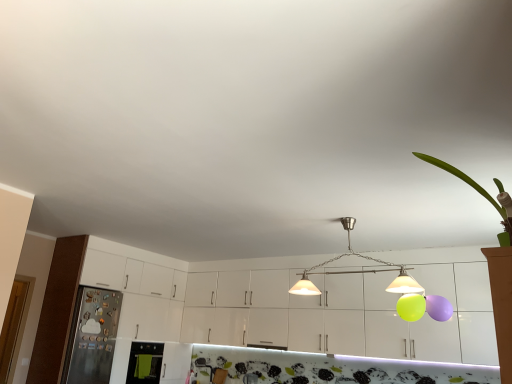
Measure the distance between green fabric oven at lower left, the 2th appliance from the left, and camera.

green fabric oven at lower left, the 2th appliance from the left, and camera are 17.53 feet apart from each other.

This screenshot has height=384, width=512. What do you see at coordinates (145, 363) in the screenshot?
I see `green fabric oven at lower left, the 2th appliance from the left` at bounding box center [145, 363].

What do you see at coordinates (249, 304) in the screenshot? The image size is (512, 384). I see `white glossy cabinets at center` at bounding box center [249, 304].

This screenshot has height=384, width=512. Identify the location of metallic refrigerator at left, the 2th appliance viewed from the right. tap(92, 336).

At what (x,y) coordinates should I click in order to perform the action: click on metallic pendant lights at center. Please return your answer as a coordinate pair (x, y). The width and height of the screenshot is (512, 384). Looking at the image, I should click on (364, 258).

Does metallic refrigerator at left, the 2th appliance viewed from the right, have a greater width compared to green fabric oven at lower left, the 2th appliance from the left?

Yes, metallic refrigerator at left, the 2th appliance viewed from the right, is wider than green fabric oven at lower left, the 2th appliance from the left.

Is metallic refrigerator at left, the 2th appliance viewed from the right, next to green fabric oven at lower left, the 2th appliance from the left, and touching it?

No, metallic refrigerator at left, the 2th appliance viewed from the right, is not beside green fabric oven at lower left, the 2th appliance from the left.

Does metallic refrigerator at left, acting as the first appliance starting from the left, have a larger size compared to green fabric oven at lower left, the 1th appliance positioned from the right?

Yes.

In the scene shown: Is metallic refrigerator at left, the 2th appliance viewed from the right, positioned with its back to green fabric oven at lower left, the 2th appliance from the left?

No, metallic refrigerator at left, the 2th appliance viewed from the right, is not facing away from green fabric oven at lower left, the 2th appliance from the left.

Which object is thinner, metallic refrigerator at left, the 2th appliance viewed from the right, or green leafy plant at upper right?

green leafy plant at upper right.

From the image's perspective, is metallic refrigerator at left, acting as the first appliance starting from the left, located above or below green leafy plant at upper right?

metallic refrigerator at left, acting as the first appliance starting from the left, is below green leafy plant at upper right.

From the image's perspective, which is above, metallic refrigerator at left, acting as the first appliance starting from the left, or white glossy cabinets at center?

white glossy cabinets at center, from the image's perspective.

From a real-world perspective, which object stands above the other?

From a 3D spatial view, white glossy cabinets at center is above.

What's the angular difference between metallic refrigerator at left, the 2th appliance viewed from the right, and white glossy cabinets at center's facing directions?

The angular difference between metallic refrigerator at left, the 2th appliance viewed from the right, and white glossy cabinets at center is 90 degrees.

Is metallic refrigerator at left, the 2th appliance viewed from the right, wider or thinner than white glossy cabinets at center?

Clearly, metallic refrigerator at left, the 2th appliance viewed from the right, has more width compared to white glossy cabinets at center.

In terms of height, does metallic pendant lights at center look taller or shorter compared to green leafy plant at upper right?

In the image, metallic pendant lights at center appears to be taller than green leafy plant at upper right.

Is metallic pendant lights at center to the right of green leafy plant at upper right from the viewer's perspective?

In fact, metallic pendant lights at center is to the left of green leafy plant at upper right.

Is metallic pendant lights at center facing away from green leafy plant at upper right?

No, green leafy plant at upper right is not at the back of metallic pendant lights at center.

Between white glossy cabinets at center and green leafy plant at upper right, which one has larger width?

white glossy cabinets at center is wider.

Considering the relative sizes of white glossy cabinets at center and green leafy plant at upper right in the image provided, is white glossy cabinets at center shorter than green leafy plant at upper right?

No.

Where is `plant positioned vertically above the white glossy cabinets at center (from a real-world perspective)`? This screenshot has height=384, width=512. plant positioned vertically above the white glossy cabinets at center (from a real-world perspective) is located at coordinates (478, 192).

From the image's perspective, which is below, green fabric oven at lower left, the 2th appliance from the left, or metallic pendant lights at center?

green fabric oven at lower left, the 2th appliance from the left, is shown below in the image.

Which appliance is the 1st one when counting from the left side of the metallic pendant lights at center? Please provide its 2D coordinates.

[(145, 363)]

From a real-world perspective, is green fabric oven at lower left, the 2th appliance from the left, physically located above or below metallic pendant lights at center?

From a real-world perspective, green fabric oven at lower left, the 2th appliance from the left, is physically below metallic pendant lights at center.

Considering the positions of objects green fabric oven at lower left, the 1th appliance positioned from the right, and metallic pendant lights at center in the image provided, who is more to the right, green fabric oven at lower left, the 1th appliance positioned from the right, or metallic pendant lights at center?

metallic pendant lights at center is more to the right.

Between green leafy plant at upper right and metallic pendant lights at center, which one has less height?

With less height is green leafy plant at upper right.

Is point (483, 195) closer or farther from the camera than point (306, 286)?

Point (483, 195) is closer to the camera than point (306, 286).

Is green leafy plant at upper right completely or partially outside of metallic pendant lights at center?

Yes.

Identify the location of appliance below the metallic refrigerator at left, the 2th appliance viewed from the right (from a real-world perspective). (145, 363).

Locate an element on the screen. This screenshot has width=512, height=384. plant above the metallic refrigerator at left, acting as the first appliance starting from the left (from a real-world perspective) is located at coordinates (478, 192).

Which object lies nearer to the anchor point green fabric oven at lower left, the 2th appliance from the left, metallic refrigerator at left, the 2th appliance viewed from the right, or metallic pendant lights at center?

metallic refrigerator at left, the 2th appliance viewed from the right, is closer to green fabric oven at lower left, the 2th appliance from the left.

Looking at this image, considering their positions, is green fabric oven at lower left, the 2th appliance from the left, positioned closer to white glossy cabinets at center than metallic pendant lights at center?

Among the two, green fabric oven at lower left, the 2th appliance from the left, is located nearer to white glossy cabinets at center.

Which object lies nearer to the anchor point green leafy plant at upper right, metallic refrigerator at left, the 2th appliance viewed from the right, or white glossy cabinets at center?

white glossy cabinets at center lies closer to green leafy plant at upper right than the other object.

Considering their positions, is green leafy plant at upper right positioned closer to white glossy cabinets at center than metallic pendant lights at center?

Based on the image, metallic pendant lights at center appears to be nearer to white glossy cabinets at center.

Which object lies nearer to the anchor point white glossy cabinets at center, metallic pendant lights at center or green leafy plant at upper right?

metallic pendant lights at center lies closer to white glossy cabinets at center than the other object.

From the image, which object appears to be nearer to green fabric oven at lower left, the 1th appliance positioned from the right, white glossy cabinets at center or metallic refrigerator at left, acting as the first appliance starting from the left?

Among the two, metallic refrigerator at left, acting as the first appliance starting from the left, is located nearer to green fabric oven at lower left, the 1th appliance positioned from the right.

Estimate the real-world distances between objects in this image. Which object is further from green leafy plant at upper right, green fabric oven at lower left, the 2th appliance from the left, or metallic refrigerator at left, the 2th appliance viewed from the right?

Based on the image, metallic refrigerator at left, the 2th appliance viewed from the right, appears to be further to green leafy plant at upper right.

Considering their positions, is green leafy plant at upper right positioned further to metallic pendant lights at center than metallic refrigerator at left, acting as the first appliance starting from the left?

The object further to metallic pendant lights at center is metallic refrigerator at left, acting as the first appliance starting from the left.

Locate an element on the screen. This screenshot has height=384, width=512. cabinetry between green fabric oven at lower left, the 1th appliance positioned from the right, and metallic pendant lights at center is located at coordinates (249, 304).

Where is `light situated between metallic refrigerator at left, acting as the first appliance starting from the left, and green leafy plant at upper right from left to right`? This screenshot has height=384, width=512. light situated between metallic refrigerator at left, acting as the first appliance starting from the left, and green leafy plant at upper right from left to right is located at coordinates (364, 258).

Identify the location of appliance between metallic refrigerator at left, the 2th appliance viewed from the right, and metallic pendant lights at center from left to right. This screenshot has height=384, width=512. (145, 363).

Image resolution: width=512 pixels, height=384 pixels. I want to click on cabinetry located between green leafy plant at upper right and green fabric oven at lower left, the 1th appliance positioned from the right, in the depth direction, so click(249, 304).